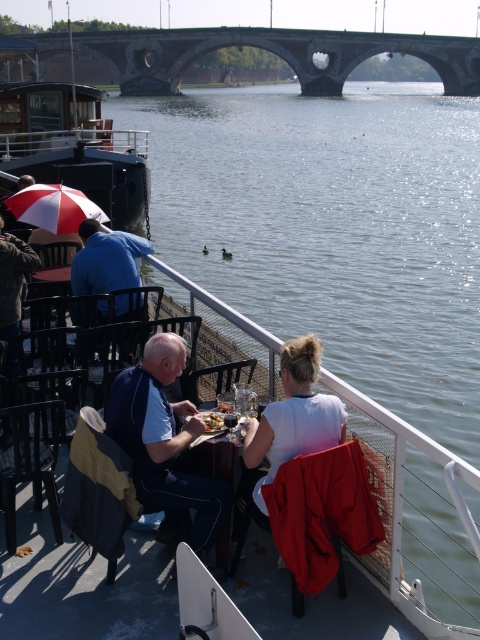
Question: Is black matte boat at left wider than wooden table at center?

Choices:
 (A) yes
 (B) no

Answer: (A)

Question: Can you confirm if white matte shirt at center is positioned to the left of wooden table at center?

Choices:
 (A) no
 (B) yes

Answer: (A)

Question: Among these points, which one is farthest from the camera?

Choices:
 (A) (222, 451)
 (B) (81, 284)
 (C) (91, 172)

Answer: (C)

Question: Which of the following is the closest to the observer?

Choices:
 (A) (294, 412)
 (B) (216, 548)
 (C) (144, 448)

Answer: (A)

Question: Does blue fabric shirt at center lie behind red and white striped umbrella at left?

Choices:
 (A) no
 (B) yes

Answer: (A)

Question: Among these objects, which one is farthest from the camera?

Choices:
 (A) blue fabric shirt at center
 (B) black matte boat at left
 (C) matte black umbrella at left

Answer: (B)